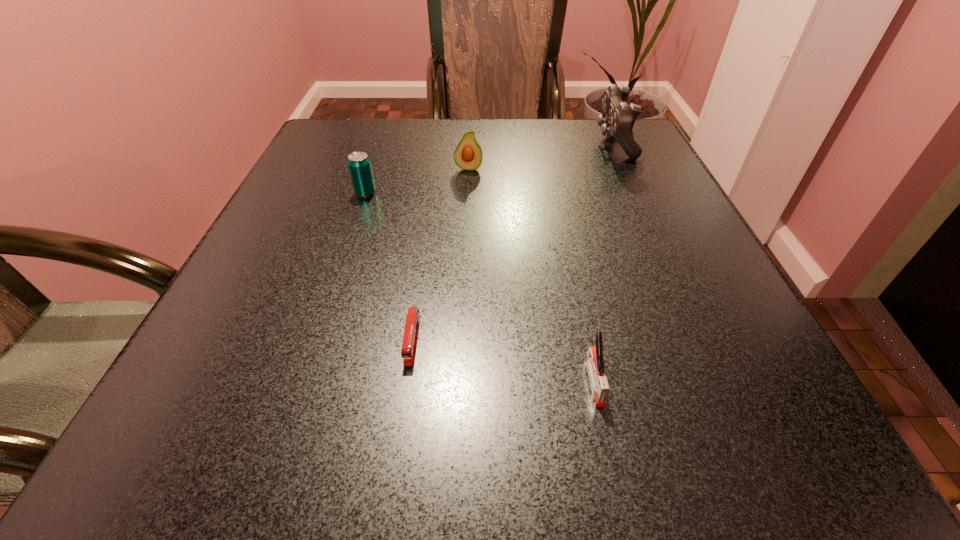
Where is `the tallest object`? the tallest object is located at coordinates (618, 119).

Where is `the rightmost object`? This screenshot has width=960, height=540. the rightmost object is located at coordinates (618, 119).

Identify the location of avocado. The image size is (960, 540). click(x=468, y=155).

Where is `the fourth nearest object`? The width and height of the screenshot is (960, 540). the fourth nearest object is located at coordinates (468, 155).

At what (x,y) coordinates should I click in order to perform the action: click on the third farthest object. Please return your answer as a coordinate pair (x, y). The image size is (960, 540). Looking at the image, I should click on (359, 165).

Find the location of a particular element. The height and width of the screenshot is (540, 960). the leftmost object is located at coordinates (359, 165).

Identify the location of the fourth object from left to right. The image size is (960, 540). (594, 356).

This screenshot has height=540, width=960. I want to click on the right stapler, so click(594, 356).

Where is `the left stapler`? the left stapler is located at coordinates (408, 352).

Find the location of a particular element. The width and height of the screenshot is (960, 540). the shortest object is located at coordinates (408, 352).